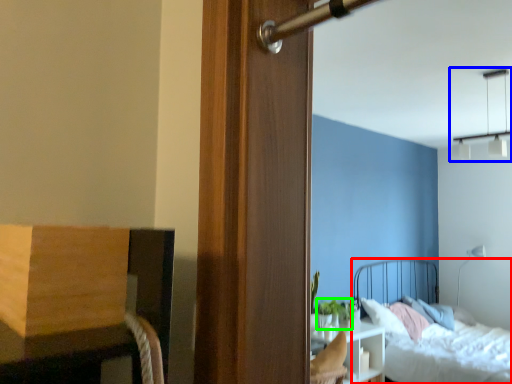
Question: Considering the real-world distances, which object is farthest from bed (highlighted by a red box)? light fixture (highlighted by a blue box) or plant (highlighted by a green box)?

Choices:
 (A) light fixture
 (B) plant

Answer: (A)